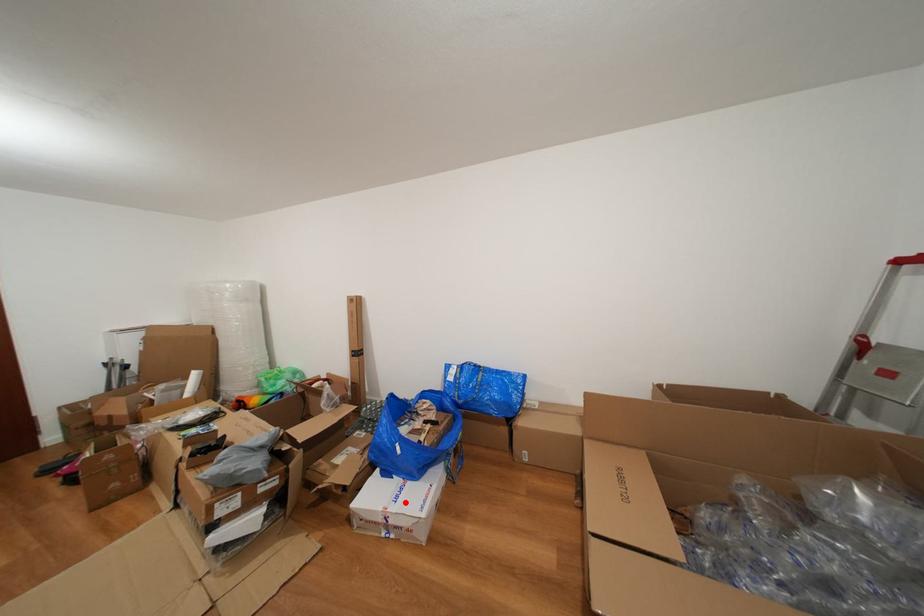
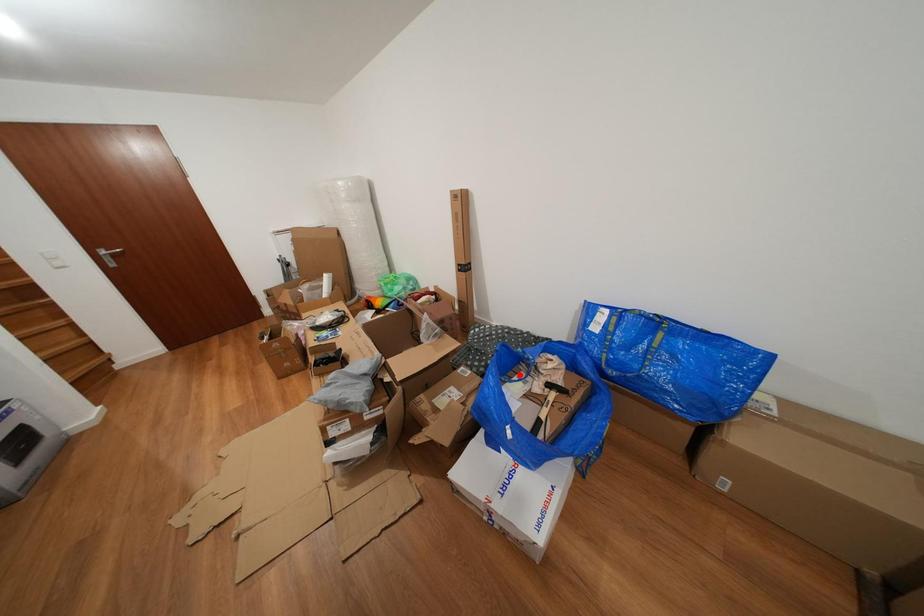
I am providing you with two images of the same scene from different viewpoints. A red point is marked on the first image and another point is marked on the second image. Is the red point in image1 aligned with the point shown in image2?

No